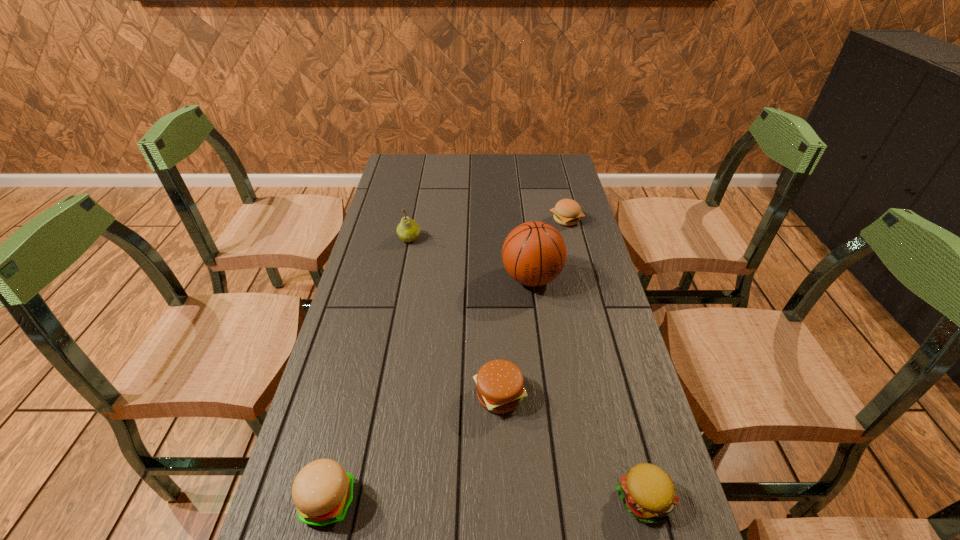
The width and height of the screenshot is (960, 540). What are the coordinates of `vacant space located 0.390m on the back of the second farthest object` in the screenshot? It's located at (422, 174).

The image size is (960, 540). Find the location of `free space located 0.300m on the right of the tallest hamburger`. free space located 0.300m on the right of the tallest hamburger is located at coordinates point(512,501).

The height and width of the screenshot is (540, 960). Find the location of `blank space located 0.260m on the front of the farthest object`. blank space located 0.260m on the front of the farthest object is located at coordinates tap(582, 282).

Find the location of a particular element. free space located on the back of the fourth farthest object is located at coordinates (496, 302).

Identify the location of pear situated at the left edge. The image size is (960, 540). (408, 230).

Where is `hamburger that is positioned at the left edge`? This screenshot has height=540, width=960. hamburger that is positioned at the left edge is located at coordinates (322, 491).

Identify the location of basketball present at the right edge. (534, 253).

Image resolution: width=960 pixels, height=540 pixels. In the image, there is a desktop. In order to click on free space at the far edge in this screenshot , I will do `click(463, 154)`.

Where is `vacant space at the left edge`? This screenshot has width=960, height=540. vacant space at the left edge is located at coordinates (405, 271).

Where is `vacant position at the right edge of the desktop`? vacant position at the right edge of the desktop is located at coordinates (588, 416).